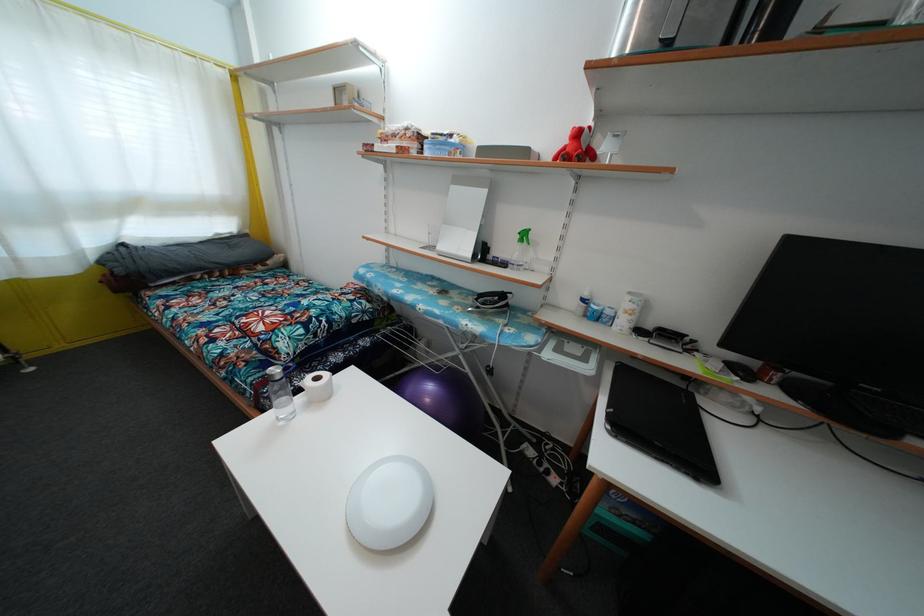
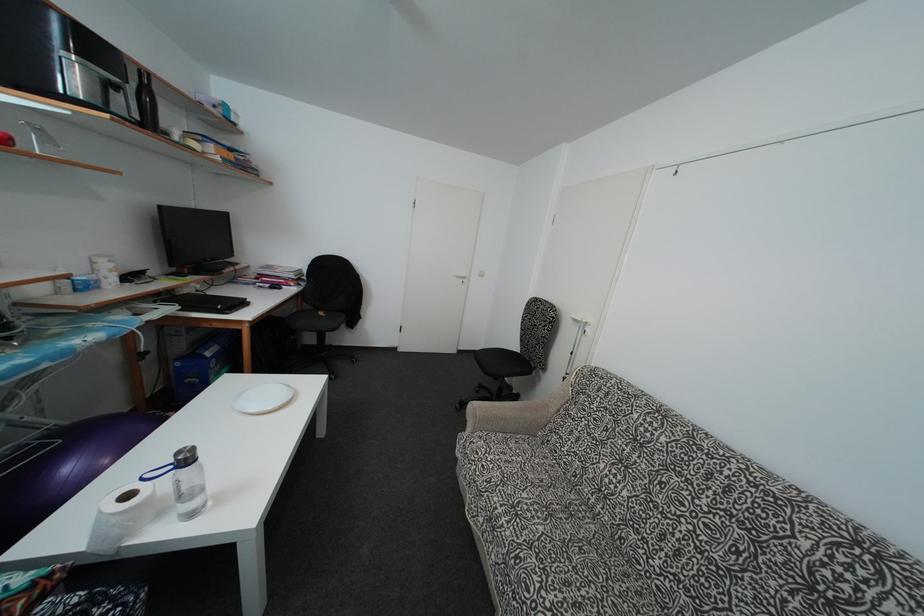
The point at (725, 394) is marked in the first image. Where is the corresponding point in the second image?

(185, 294)